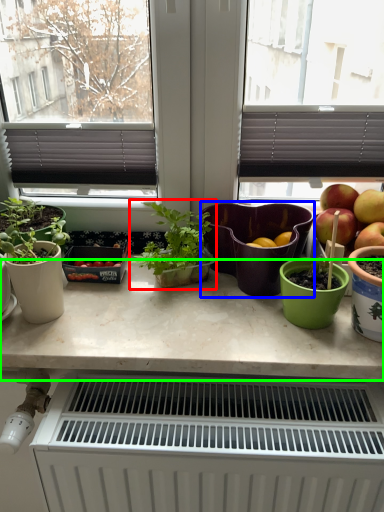
Question: Based on their relative distances, which object is nearer to houseplant (highlighted by a red box)? Choose from flowerpot (highlighted by a blue box) and countertop (highlighted by a green box).

Choices:
 (A) flowerpot
 (B) countertop

Answer: (A)